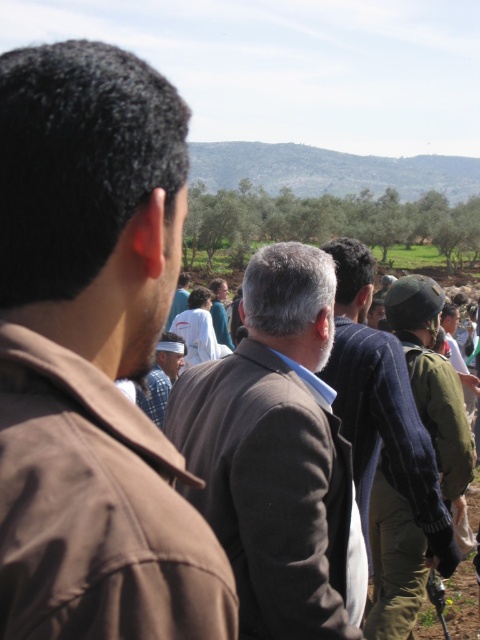
Question: Is brown fabric jacket at left positioned in front of blue plaid shirt at center?

Choices:
 (A) no
 (B) yes

Answer: (B)

Question: Does brown woolen jacket at center have a lesser width compared to white cotton shirt at center?

Choices:
 (A) yes
 (B) no

Answer: (A)

Question: Which point is farther to the camera?

Choices:
 (A) white cotton shirt at center
 (B) green military uniform at right
 (C) blue plaid shirt at center

Answer: (A)

Question: Estimate the real-world distances between objects in this image. Which object is farther from the white cotton shirt at center?

Choices:
 (A) blue plaid shirt at center
 (B) brown woolen jacket at center
 (C) green military uniform at right

Answer: (B)

Question: Considering the real-world distances, which object is closest to the brown fabric jacket at left?

Choices:
 (A) green military uniform at right
 (B) blue plaid shirt at center
 (C) white cotton shirt at center
 (D) brown woolen jacket at center

Answer: (D)

Question: Does brown fabric jacket at left appear under brown woolen jacket at center?

Choices:
 (A) yes
 (B) no

Answer: (B)